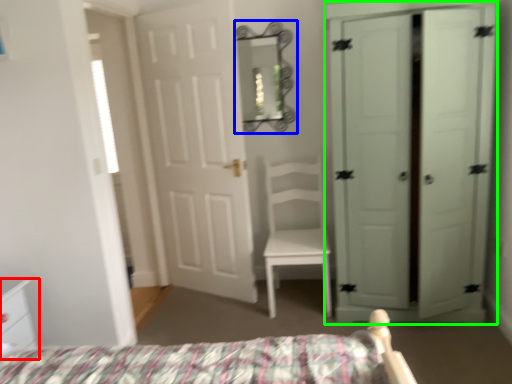
Question: Which object is the farthest from nightstand (highlighted by a red box)? Choose among these: mirror (highlighted by a blue box) or door (highlighted by a green box).

Choices:
 (A) mirror
 (B) door

Answer: (B)